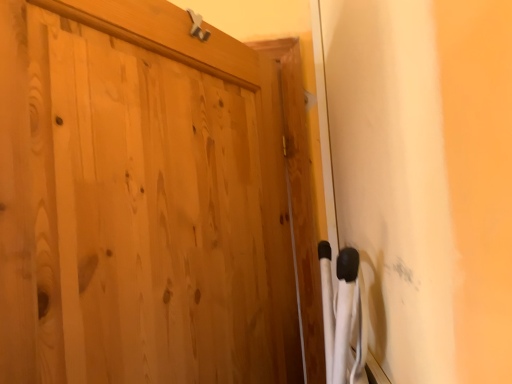
The height and width of the screenshot is (384, 512). What do you see at coordinates (140, 201) in the screenshot?
I see `natural wood door at center` at bounding box center [140, 201].

The height and width of the screenshot is (384, 512). I want to click on natural wood door at center, so click(x=140, y=201).

Image resolution: width=512 pixels, height=384 pixels. I want to click on natural wood door at center, so click(140, 201).